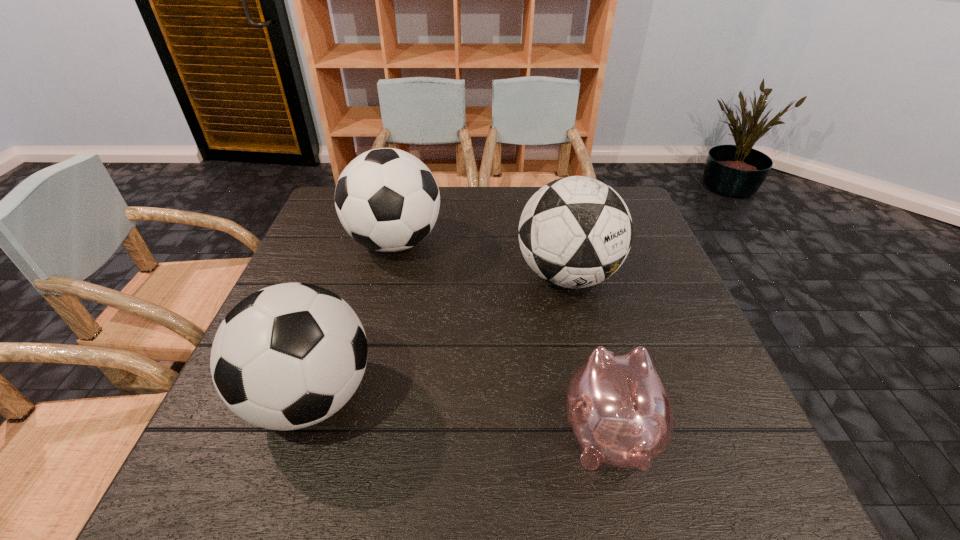
This screenshot has width=960, height=540. In order to click on the rightmost soccer ball in this screenshot , I will do `click(574, 232)`.

Locate an element on the screen. the nearest soccer ball is located at coordinates (288, 356).

This screenshot has height=540, width=960. Find the location of `the shortest object`. the shortest object is located at coordinates (619, 409).

I want to click on free space located 0.290m on the surface of the rightmost soccer ball where the brand logo is visible, so click(x=602, y=426).

Where is `free space located 0.190m on the right of the nearest soccer ball`? Image resolution: width=960 pixels, height=540 pixels. free space located 0.190m on the right of the nearest soccer ball is located at coordinates (474, 396).

Locate an element on the screen. The width and height of the screenshot is (960, 540). free region located 0.230m on the front facing side of the piggy bank is located at coordinates (578, 304).

The width and height of the screenshot is (960, 540). What are the coordinates of `vacant space located on the front facing side of the piggy bank` in the screenshot? It's located at (572, 281).

Locate an element on the screen. This screenshot has width=960, height=540. free location located on the front facing side of the piggy bank is located at coordinates (580, 313).

At what (x,y) coordinates should I click in order to perform the action: click on object that is at the far edge. Please return your answer as a coordinate pair (x, y). This screenshot has height=540, width=960. Looking at the image, I should click on (387, 200).

At what (x,y) coordinates should I click in order to perform the action: click on soccer ball located in the near edge section of the desktop. Please return your answer as a coordinate pair (x, y). The height and width of the screenshot is (540, 960). Looking at the image, I should click on (288, 356).